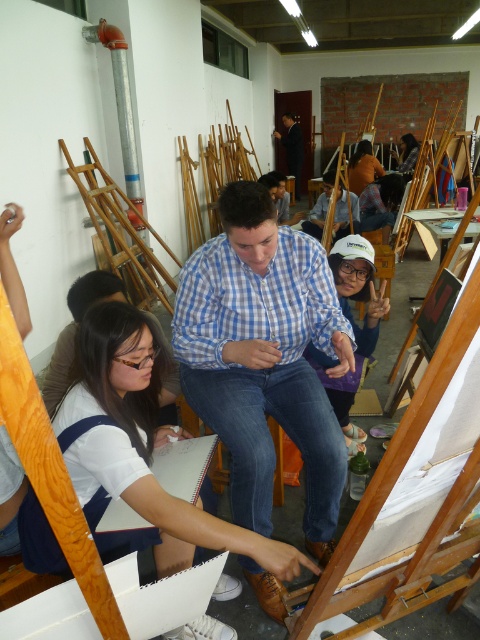
Is point (154, 552) more distant than point (291, 147)?

No, it is in front of (291, 147).

In the scene shown: Is white matte paper at lower left shorter than dark blue shirt at center?

Correct, white matte paper at lower left is not as tall as dark blue shirt at center.

Between point (111, 317) and point (295, 156), which one is positioned in front?

Point (111, 317)

Identify the location of white matte paper at lower left. The image size is (480, 640). (141, 449).

Is blue plaid shirt at center to the right of matte brown hair at center from the viewer's perspective?

In fact, blue plaid shirt at center is to the left of matte brown hair at center.

Describe the element at coordinates (320, 208) in the screenshot. I see `blue plaid shirt at center` at that location.

Where is `blue plaid shirt at center`? Image resolution: width=480 pixels, height=640 pixels. blue plaid shirt at center is located at coordinates (320, 208).

Does point (282, 579) lie in front of point (360, 150)?

Yes.

Describe the element at coordinates (141, 449) in the screenshot. I see `white matte paper at lower left` at that location.

The image size is (480, 640). What are the coordinates of `white matte paper at lower left` in the screenshot? It's located at (141, 449).